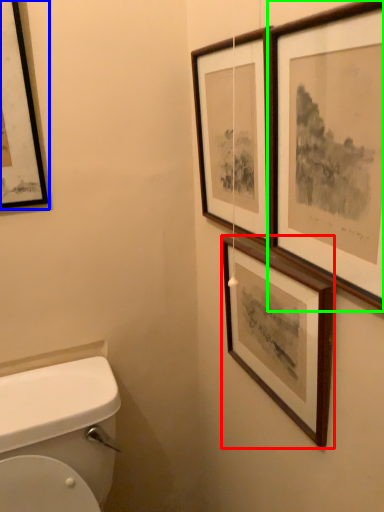
Question: Considering the real-world distances, which object is farthest from picture frame (highlighted by a red box)? picture frame (highlighted by a blue box) or picture frame (highlighted by a green box)?

Choices:
 (A) picture frame
 (B) picture frame

Answer: (A)